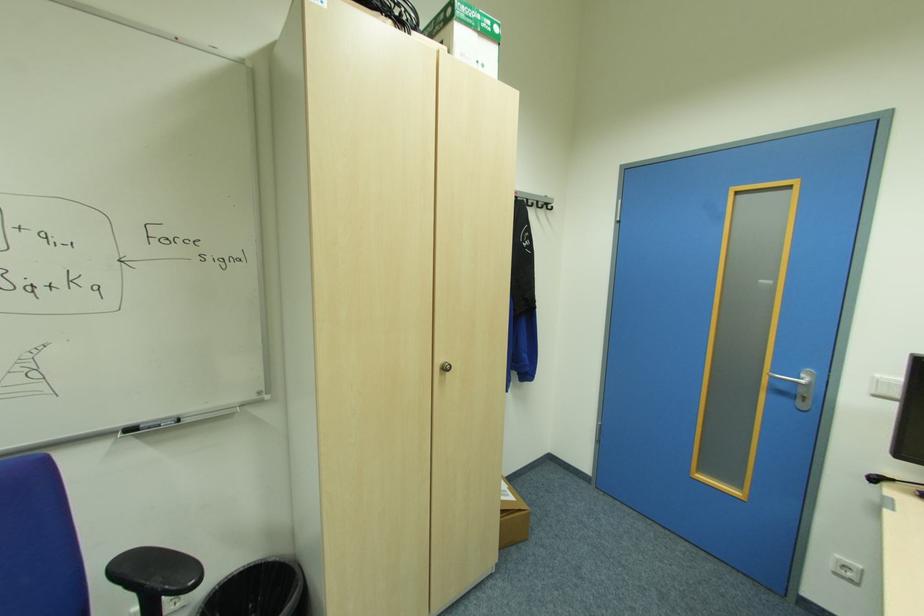
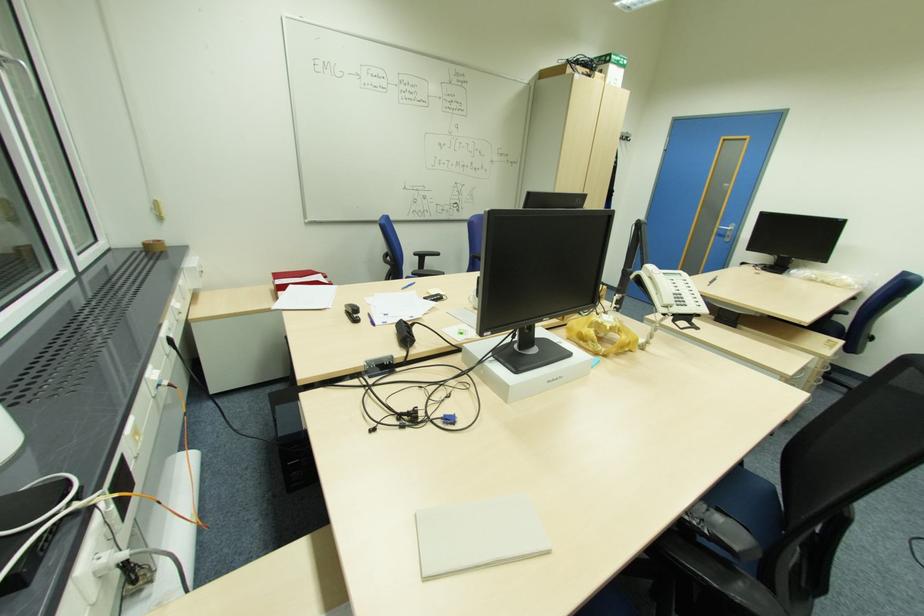
In a continuous first-person perspective shot, in which direction is the camera moving?

The cameraman moved toward left, backward.